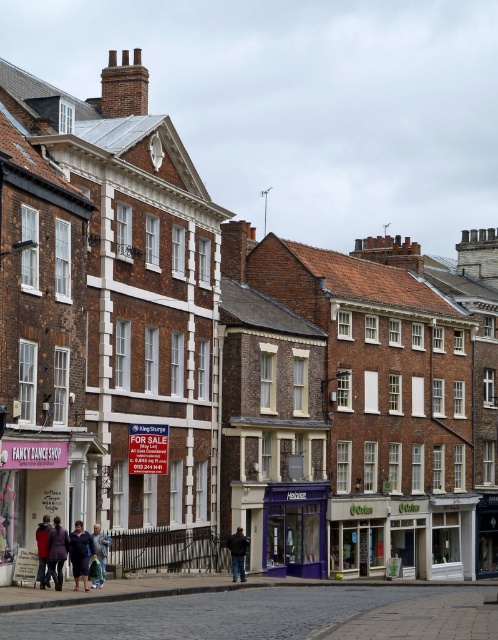
You are a delivery person with a package that is 1 meter wide. You need to deliver it through the narrowest path between the purple glass storefront at center and the dark blue jacket at lower left. Can your package fit through the path?

The purple glass storefront at center is wider than the dark blue jacket at lower left, so the narrowest path between them would be the width of the dark blue jacket at lower left. Since the package is 1 meter wide and the dark blue jacket at lower left is narrower than that, the package cannot fit through the path.

You are a delivery person trying to find the purple glass storefront at center. You see a dark blue jacket at lower left nearby. Which object is bigger in size?

The purple glass storefront at center is larger in size than the dark blue jacket at lower left.